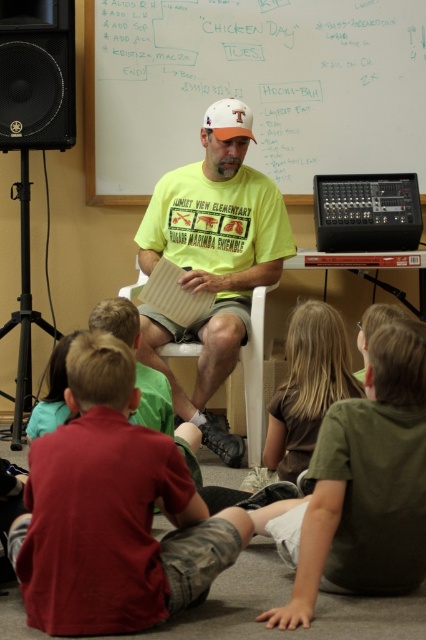
Question: Considering the relative positions of green cotton shirt at lower right and brown smooth shirt at lower center in the image provided, where is green cotton shirt at lower right located with respect to brown smooth shirt at lower center?

Choices:
 (A) above
 (B) below

Answer: (B)

Question: Which object is positioned farthest from the whiteboard at upper center?

Choices:
 (A) brown smooth shirt at lower center
 (B) orange fabric baseball cap at center

Answer: (A)

Question: Estimate the real-world distances between objects in this image. Which object is farther from the green cotton shirt at lower right?

Choices:
 (A) brown smooth shirt at lower center
 (B) yellow t-shirt at center
 (C) whiteboard at upper center
 (D) orange fabric baseball cap at center

Answer: (C)

Question: Which object appears farthest from the camera in this image?

Choices:
 (A) black matte speaker at upper left
 (B) green cotton shirt at lower right
 (C) brown smooth shirt at lower center
 (D) whiteboard at upper center

Answer: (D)

Question: Is black matte speaker at upper left above brown smooth shirt at lower center?

Choices:
 (A) no
 (B) yes

Answer: (B)

Question: Can you confirm if yellow t-shirt at center is bigger than brown smooth shirt at lower center?

Choices:
 (A) no
 (B) yes

Answer: (B)